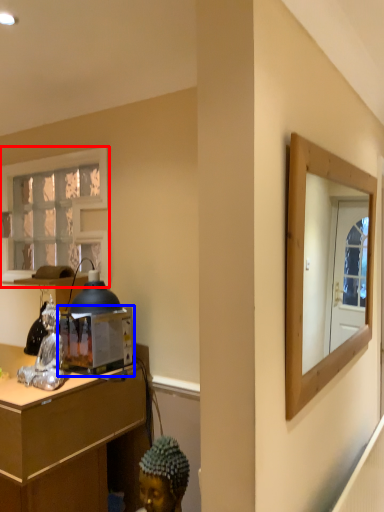
Question: Which point is closer to the camera, window (highlighted by a red box) or appliance (highlighted by a blue box)?

Choices:
 (A) window
 (B) appliance

Answer: (B)